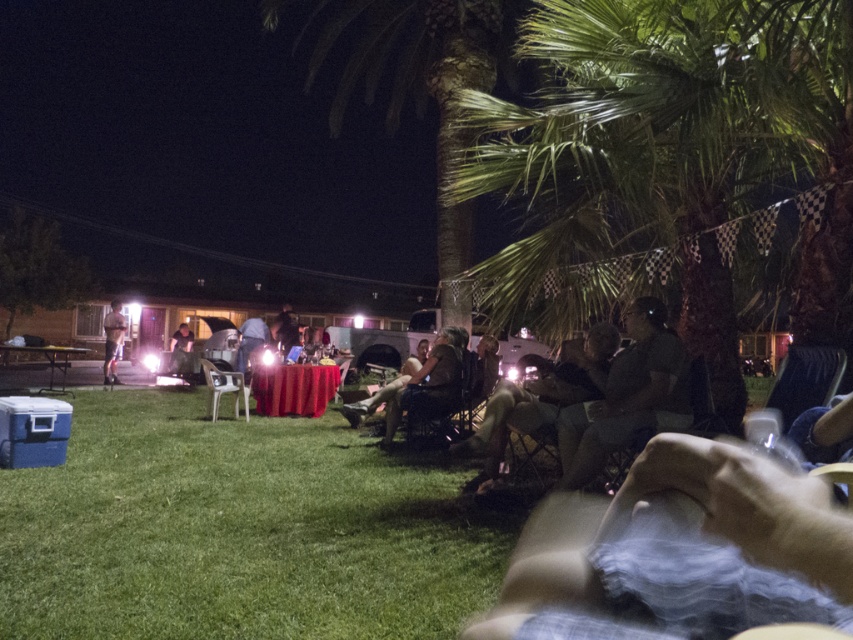
You are standing at the back of the gathering and want to retrieve your light brown leather jacket at center. There is green grass at lower left in the way. Can you step onto the grass to reach your jacket?

The green grass at lower left is in front of the light brown leather jacket at center, so you can step onto the grass to reach your jacket since it is closer to you.

You are standing in the backyard and want to place a small decoration between the two points, point (155, 588) and point (115, 381). Which point should the decoration be closer to in order to appear larger in the photo taken from your current position?

The decoration should be placed closer to point (155, 588) because it is closer to the camera, making the decoration appear larger in the photo.